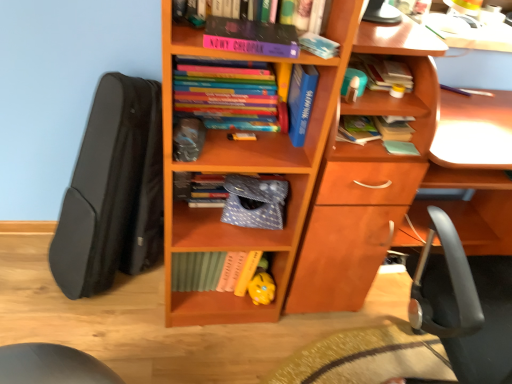
Describe the element at coordinates (261, 288) in the screenshot. I see `yellow matte piggy bank at lower center` at that location.

The image size is (512, 384). Describe the element at coordinates (393, 130) in the screenshot. I see `hardcover book at upper right, which is the 1th book from right to left` at that location.

Where is `hardcover book at upper right, which ranks as the sixth book in left-to-right order`? The width and height of the screenshot is (512, 384). hardcover book at upper right, which ranks as the sixth book in left-to-right order is located at coordinates (382, 71).

You are a GUI agent. You are given a task and a screenshot of the screen. Output one action in this format:
    pyautogui.click(x=<x>, y=<y>)
    Task: Click on the blue matte book at upper center, the fourth book positioned from the left
    This screenshot has width=512, height=384.
    Given the screenshot: What is the action you would take?
    pyautogui.click(x=318, y=45)

Locate an element on the screen. purple matte book at upper center, which is counted as the sixth book, starting from the right is located at coordinates (251, 37).

Identify the location of yellow matte piggy bank at lower center. (261, 288).

Can you see black matte guitar case at left touching wooden bookcase at center?

No, black matte guitar case at left is not in contact with wooden bookcase at center.

From a real-world perspective, relative to wooden bookcase at center, is black matte guitar case at left vertically above or below?

black matte guitar case at left is below wooden bookcase at center.

Is black matte guitar case at left in front of or behind wooden bookcase at center in the image?

black matte guitar case at left is behind wooden bookcase at center.

Is blue hardcover book at upper center, which is the fifth book in right-to-left order, inside the boundaries of purple matte book at upper center, positioned as the 2th book in left-to-right order, or outside?

blue hardcover book at upper center, which is the fifth book in right-to-left order, is outside purple matte book at upper center, positioned as the 2th book in left-to-right order.

Is blue hardcover book at upper center, the 3th book positioned from the left, facing away from purple matte book at upper center, which is counted as the sixth book, starting from the right?

That's not correct — blue hardcover book at upper center, the 3th book positioned from the left, is not looking away from purple matte book at upper center, which is counted as the sixth book, starting from the right.

Is blue hardcover book at upper center, which is the fifth book in right-to-left order, wider or thinner than purple matte book at upper center, which is counted as the sixth book, starting from the right?

blue hardcover book at upper center, which is the fifth book in right-to-left order, is wider than purple matte book at upper center, which is counted as the sixth book, starting from the right.

Which of these two, blue hardcover book at upper center, which is the fifth book in right-to-left order, or purple matte book at upper center, positioned as the 2th book in left-to-right order, stands shorter?

With less height is purple matte book at upper center, positioned as the 2th book in left-to-right order.

Who is more distant, hardcover book at upper right, arranged as the second book when viewed from the right, or yellow matte piggy bank at lower center?

yellow matte piggy bank at lower center is further away from the camera.

Is hardcover book at upper right, which ranks as the sixth book in left-to-right order, placed right next to yellow matte piggy bank at lower center?

No, hardcover book at upper right, which ranks as the sixth book in left-to-right order, is not in contact with yellow matte piggy bank at lower center.

Where is `toy below the hardcover book at upper right, which ranks as the sixth book in left-to-right order (from the image's perspective)`? The height and width of the screenshot is (384, 512). toy below the hardcover book at upper right, which ranks as the sixth book in left-to-right order (from the image's perspective) is located at coordinates (261, 288).

Based on their sizes in the image, would you say blue hardcover book at upper center, which is the fifth book in right-to-left order, is bigger or smaller than wooden bookcase at center?

In the image, blue hardcover book at upper center, which is the fifth book in right-to-left order, appears to be smaller than wooden bookcase at center.

Is blue hardcover book at upper center, which is the fifth book in right-to-left order, in front of or behind wooden bookcase at center in the image?

Visually, blue hardcover book at upper center, which is the fifth book in right-to-left order, is located behind wooden bookcase at center.

Is blue hardcover book at upper center, the 3th book positioned from the left, wider or thinner than wooden bookcase at center?

Considering their sizes, blue hardcover book at upper center, the 3th book positioned from the left, looks slimmer than wooden bookcase at center.

Consider the image. Is wooden bookcase at center facing away from blue matte book at upper center, the 4th book when ordered from right to left?

wooden bookcase at center is not turned away from blue matte book at upper center, the 4th book when ordered from right to left.

Can you confirm if wooden bookcase at center is positioned to the right of blue matte book at upper center, the fourth book positioned from the left?

In fact, wooden bookcase at center is to the left of blue matte book at upper center, the fourth book positioned from the left.

Are wooden bookcase at center and blue matte book at upper center, the fourth book positioned from the left, making contact?

wooden bookcase at center and blue matte book at upper center, the fourth book positioned from the left, are not in contact.

Is the depth of wooden bookcase at center greater than that of blue matte book at upper center, the 4th book when ordered from right to left?

No.

From the image's perspective, which is below, wooden bookcase at center or hardcover book at center, the fifth book viewed from the left?

wooden bookcase at center, from the image's perspective.

How much distance is there between wooden bookcase at center and hardcover book at center, which appears as the third book when viewed from the right?

33.74 centimeters.

Can you confirm if wooden bookcase at center is thinner than hardcover book at center, the fifth book viewed from the left?

Incorrect, the width of wooden bookcase at center is not less than that of hardcover book at center, the fifth book viewed from the left.

Consider the image. Is hardcover book at center, the fifth book viewed from the left, surrounded by wooden bookcase at center?

No, wooden bookcase at center does not contain hardcover book at center, the fifth book viewed from the left.

Is purple matte book at upper center, which ranks as the 7th book in right-to-left order, situated inside purple matte book at upper center, which is counted as the sixth book, starting from the right, or outside?

purple matte book at upper center, which ranks as the 7th book in right-to-left order, is not enclosed by purple matte book at upper center, which is counted as the sixth book, starting from the right.

Is purple matte book at upper center, which ranks as the 1th book in left-to-right order, beside purple matte book at upper center, which is counted as the sixth book, starting from the right?

No, purple matte book at upper center, which ranks as the 1th book in left-to-right order, is not beside purple matte book at upper center, which is counted as the sixth book, starting from the right.

Locate an element on the screen. The width and height of the screenshot is (512, 384). the 1st book below the purple matte book at upper center, positioned as the 2th book in left-to-right order (from the image's perspective) is located at coordinates (229, 94).

Is point (244, 129) behind point (292, 29)?

Yes, point (244, 129) is behind point (292, 29).

What are the coordinates of `open lying on the left of wooden bookcase at center` in the screenshot? It's located at (113, 191).

Find the location of a particular element. Image resolution: width=512 pixels, height=384 pixels. the 3rd book directly above the blue hardcover book at upper center, which is the fifth book in right-to-left order (from a real-world perspective) is located at coordinates (251, 37).

Considering their positions, is purple matte book at upper center, which ranks as the 7th book in right-to-left order, positioned further to blue hardcover book at upper center, which is the fifth book in right-to-left order, than black matte guitar case at left?

black matte guitar case at left lies further to blue hardcover book at upper center, which is the fifth book in right-to-left order, than the other object.

Based on the photo, looking at the image, which one is located closer to blue hardcover book at upper center, which is the fifth book in right-to-left order, hardcover book at upper right, positioned as the seventh book in left-to-right order, or wooden bookcase at center?

hardcover book at upper right, positioned as the seventh book in left-to-right order, is positioned closer to the anchor blue hardcover book at upper center, which is the fifth book in right-to-left order.

Based on their spatial positions, is hardcover book at center, the fifth book viewed from the left, or yellow matte piggy bank at lower center further from purple matte book at upper center, positioned as the 2th book in left-to-right order?

The object further to purple matte book at upper center, positioned as the 2th book in left-to-right order, is yellow matte piggy bank at lower center.

Looking at this image, from the image, which object appears to be farther from purple matte book at upper center, which ranks as the 7th book in right-to-left order, black matte guitar case at left or wooden bookcase at center?

The object further to purple matte book at upper center, which ranks as the 7th book in right-to-left order, is black matte guitar case at left.

Estimate the real-world distances between objects in this image. Which object is further from purple matte book at upper center, which is counted as the sixth book, starting from the right, purple matte book at upper center, which ranks as the 1th book in left-to-right order, or blue hardcover book at upper center, the 3th book positioned from the left?

The object further to purple matte book at upper center, which is counted as the sixth book, starting from the right, is purple matte book at upper center, which ranks as the 1th book in left-to-right order.

When comparing their distances from hardcover book at upper right, arranged as the second book when viewed from the right, does blue hardcover book at upper center, the 3th book positioned from the left, or purple matte book at upper center, which is counted as the sixth book, starting from the right, seem further?

Among the two, purple matte book at upper center, which is counted as the sixth book, starting from the right, is located further to hardcover book at upper right, arranged as the second book when viewed from the right.

Estimate the real-world distances between objects in this image. Which object is further from wooden bookcase at center, hardcover book at upper right, positioned as the seventh book in left-to-right order, or hardcover book at center, the fifth book viewed from the left?

hardcover book at upper right, positioned as the seventh book in left-to-right order, is positioned further to the anchor wooden bookcase at center.

Estimate the real-world distances between objects in this image. Which object is further from hardcover book at center, the fifth book viewed from the left, yellow matte piggy bank at lower center or black matte guitar case at left?

Among the two, black matte guitar case at left is located further to hardcover book at center, the fifth book viewed from the left.

At what (x,y) coordinates should I click in order to perform the action: click on bookcase between blue hardcover book at upper center, which is the fifth book in right-to-left order, and yellow matte piggy bank at lower center from top to bottom. Please return your answer as a coordinate pair (x, y). The image size is (512, 384). Looking at the image, I should click on (318, 188).

Find the location of a particular element. Image resolution: width=512 pixels, height=384 pixels. bookcase between purple matte book at upper center, which ranks as the 7th book in right-to-left order, and yellow matte piggy bank at lower center vertically is located at coordinates (318, 188).

This screenshot has height=384, width=512. I want to click on book between black matte guitar case at left and purple matte book at upper center, which is counted as the sixth book, starting from the right, from left to right, so click(229, 94).

Identify the location of bookcase between black matte guitar case at left and hardcover book at upper right, arranged as the second book when viewed from the right. (318, 188).